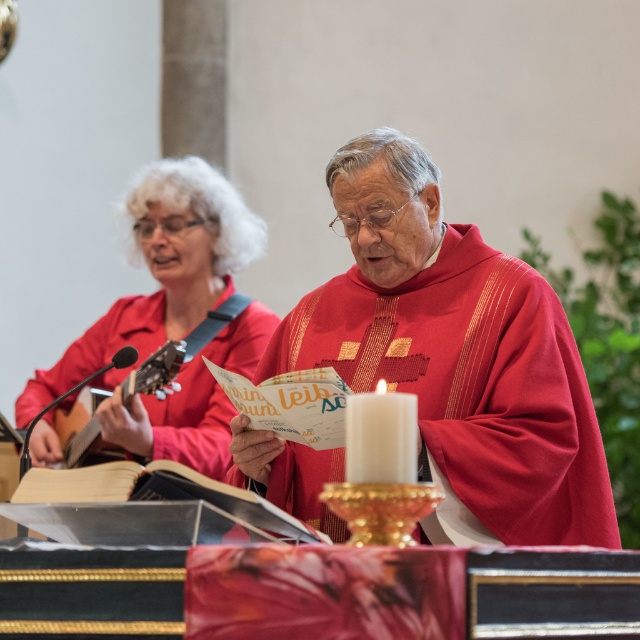
Question: Can you confirm if matte red vestment at center is wider than white wax candle at center?

Choices:
 (A) yes
 (B) no

Answer: (A)

Question: Among these points, which one is nearest to the camera?

Choices:
 (A) (161, 362)
 (B) (372, 477)
 (C) (588, 474)
 (D) (212, 410)

Answer: (B)

Question: Does matte red vestment at center lie behind acoustic wood guitar at left?

Choices:
 (A) no
 (B) yes

Answer: (A)

Question: Does matte red vestment at center appear on the right side of matte red shirt at upper left?

Choices:
 (A) no
 (B) yes

Answer: (B)

Question: Estimate the real-world distances between objects in this image. Which object is closer to the matte red shirt at upper left?

Choices:
 (A) acoustic wood guitar at left
 (B) matte red vestment at center
 (C) white wax candle at center

Answer: (A)

Question: Considering the real-world distances, which object is closest to the matte red vestment at center?

Choices:
 (A) white wax candle at center
 (B) matte red shirt at upper left
 (C) acoustic wood guitar at left

Answer: (C)